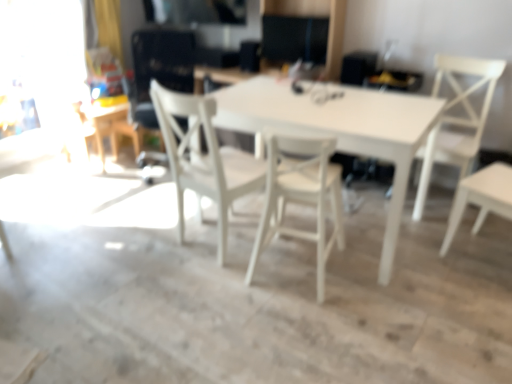
Where is `vacant space in white wood chair at center, the 2th chair from the left (from a real-world perspective)`? vacant space in white wood chair at center, the 2th chair from the left (from a real-world perspective) is located at coordinates (289, 269).